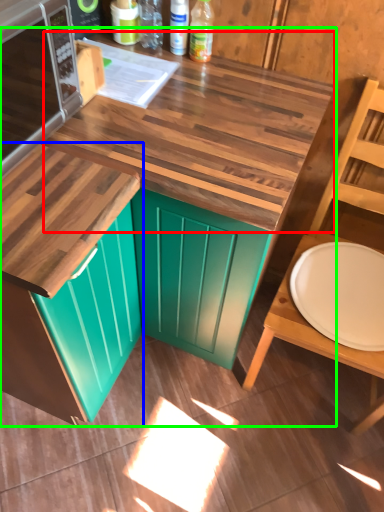
Question: Estimate the real-world distances between objects in this image. Which object is closer to counter top (highlighted by a red box), cabinetry (highlighted by a blue box) or countertop (highlighted by a green box)?

Choices:
 (A) cabinetry
 (B) countertop

Answer: (B)